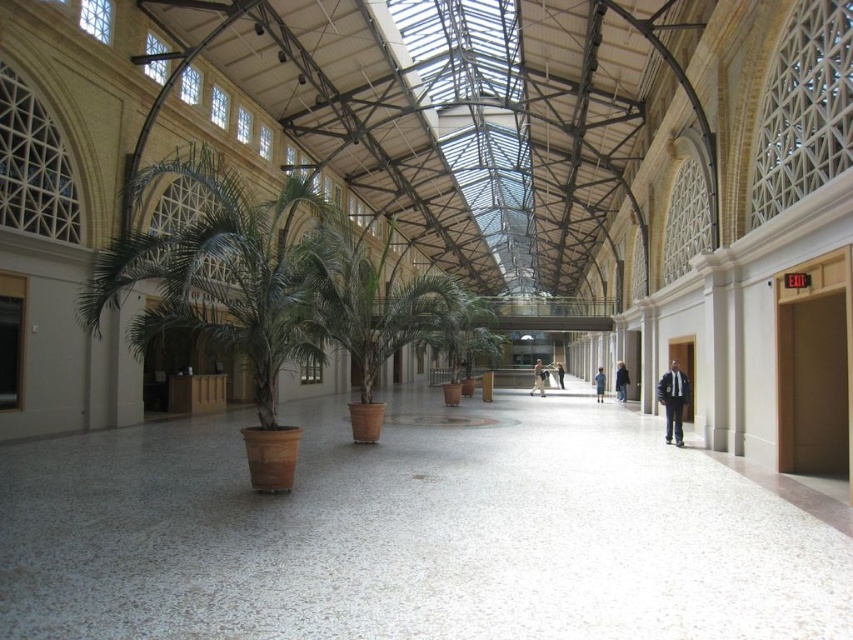
Question: Which point is closer to the camera?

Choices:
 (A) (558, 364)
 (B) (672, 428)
 (C) (538, 380)

Answer: (B)

Question: Which object appears farthest from the camera in this image?

Choices:
 (A) dark blue jeans at center
 (B) black suit at center

Answer: (B)

Question: Does green matte palm tree at center have a lesser width compared to blue fabric coat at center?

Choices:
 (A) no
 (B) yes

Answer: (A)

Question: Which of the following is the farthest from the observer?

Choices:
 (A) (602, 381)
 (B) (556, 371)

Answer: (B)

Question: Does green matte palm tree at center lie behind black suit at center?

Choices:
 (A) yes
 (B) no

Answer: (B)

Question: Does green matte palm tree at center have a smaller size compared to blue fabric coat at center?

Choices:
 (A) no
 (B) yes

Answer: (A)